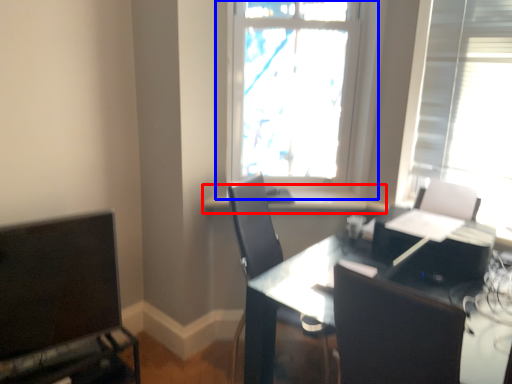
Question: Which object is further to the camera taking this photo, window sill (highlighted by a red box) or window (highlighted by a blue box)?

Choices:
 (A) window sill
 (B) window

Answer: (A)